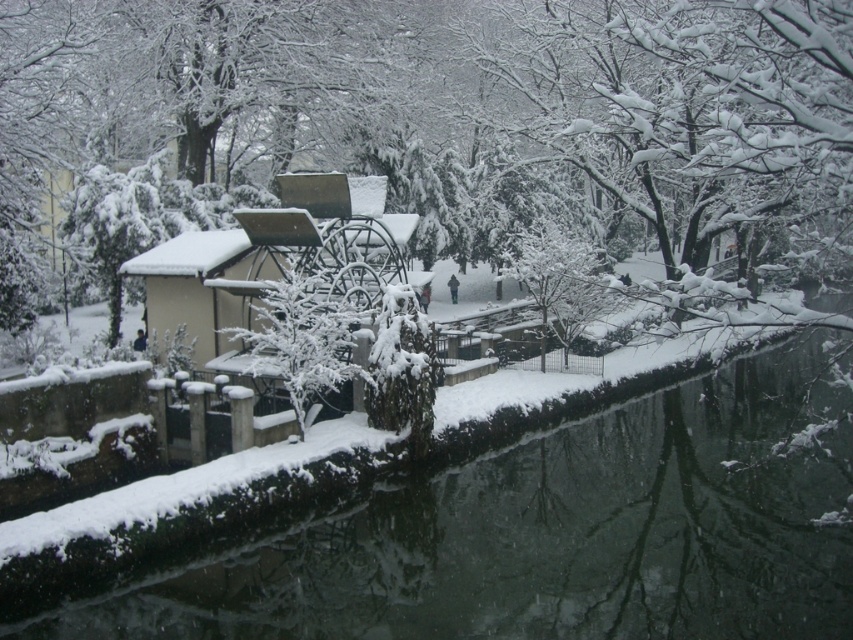
You are standing at the point labeled point (x=641, y=528) and want to move towards the point labeled point (x=213, y=232). Based on the scene description, will you be moving towards the foreground or the background of the image?

You will be moving towards the background of the image because point (x=213, y=232) is farther from the camera than point (x=641, y=528).

You are standing at the edge of the snowy concrete river at lower left and want to throw a snowball to a friend who is 30 feet away from you. Can you reach them with your snowball?

The snowy concrete river at lower left is 28.01 feet from viewer, so yes, you can reach your friend who is 30 feet away because 28.01 feet is less than 30 feet.